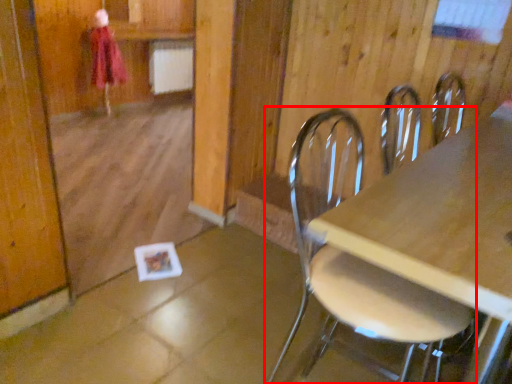
Question: Observing the image, what is the correct spatial positioning of chair (annotated by the red box) in reference to person?

Choices:
 (A) left
 (B) right

Answer: (B)